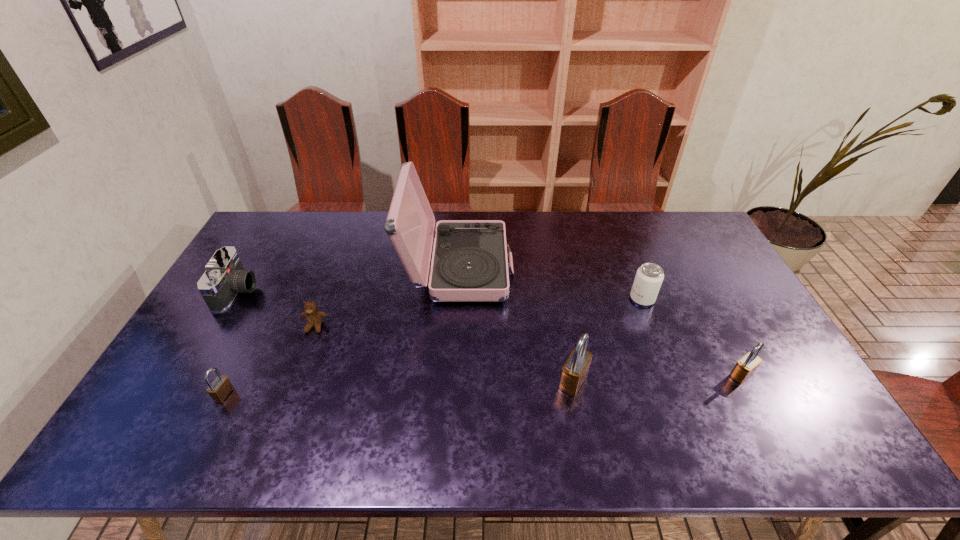
This screenshot has height=540, width=960. Find the location of `the second object from left to right`. the second object from left to right is located at coordinates (220, 388).

What are the coordinates of `the leftmost padlock` in the screenshot? It's located at (220, 388).

You are a GUI agent. You are given a task and a screenshot of the screen. Output one action in this format:
    pyautogui.click(x=<x>, y=<y>)
    Task: Click on the fifth object from left to right
    The height and width of the screenshot is (540, 960).
    Given the screenshot: What is the action you would take?
    pyautogui.click(x=575, y=370)

Identify the location of the second tallest object. (575, 370).

Find the location of a particular element. This screenshot has height=540, width=960. the rightmost object is located at coordinates (746, 366).

Where is `the rightmost padlock`? the rightmost padlock is located at coordinates (746, 366).

At what (x,y) coordinates should I click in order to perform the action: click on soda can. Please return your answer as a coordinate pair (x, y). Image resolution: width=960 pixels, height=540 pixels. Looking at the image, I should click on (649, 277).

Locate an element on the screen. The image size is (960, 540). the fifth object from right to left is located at coordinates (314, 317).

Locate an element on the screen. The image size is (960, 540). the fourth farthest object is located at coordinates (314, 317).

At what (x,y) coordinates should I click in order to perform the action: click on the fourth object from right to left. Please return your answer as a coordinate pair (x, y). The height and width of the screenshot is (540, 960). Looking at the image, I should click on (469, 263).